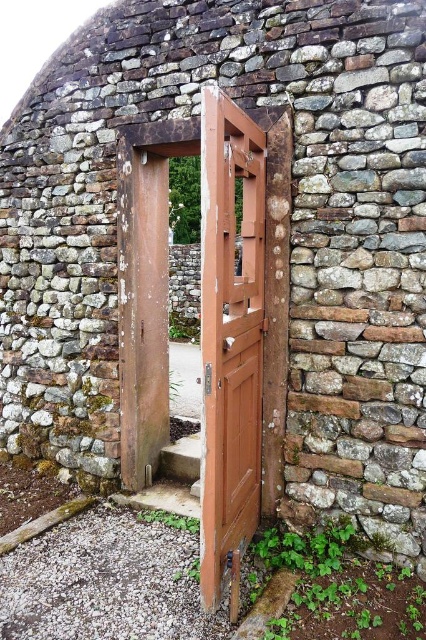
Question: Can you confirm if brown wooden door at center is positioned to the right of wooden door at center?

Choices:
 (A) no
 (B) yes

Answer: (B)

Question: Does brown wooden door at center appear on the right side of wooden door at center?

Choices:
 (A) yes
 (B) no

Answer: (A)

Question: Is brown wooden door at center further to camera compared to wooden door at center?

Choices:
 (A) yes
 (B) no

Answer: (A)